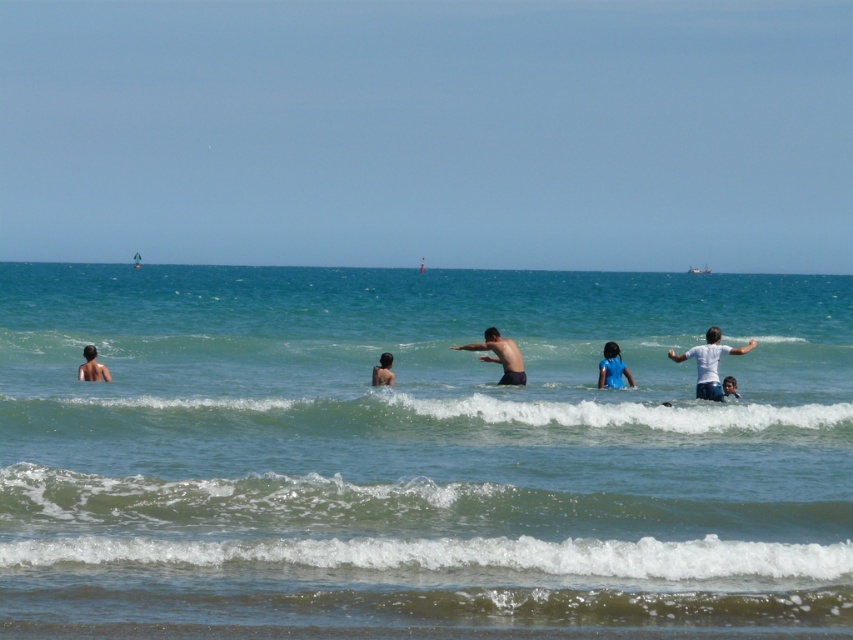
You are a photographer trying to capture the clear blue water at center in the image. According to the coordinates provided, where exactly should you focus your camera lens?

The clear blue water at center is located at coordinates point (419, 456), so you should focus your camera lens there.